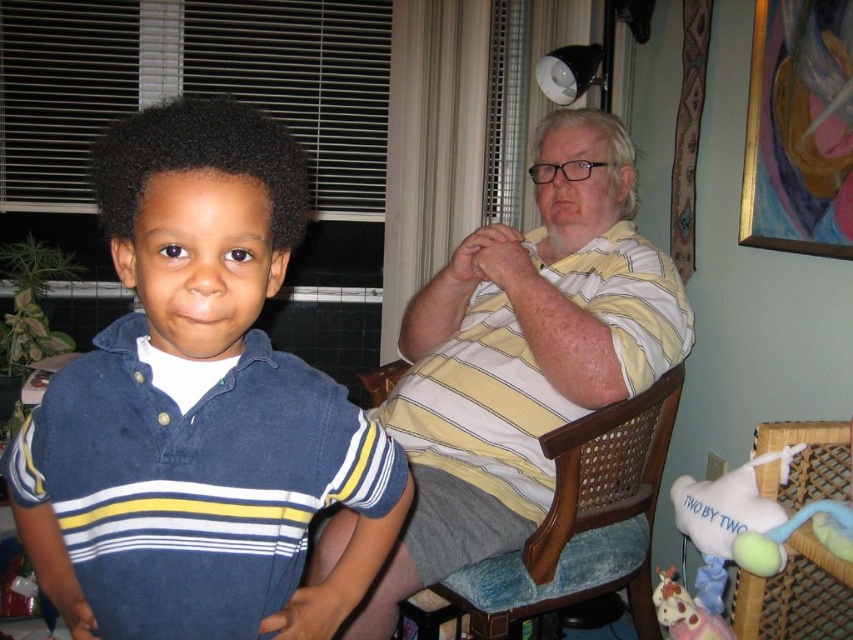
Question: Can you confirm if matte blue shirt at left is wider than woven wicker chair at lower right?

Choices:
 (A) yes
 (B) no

Answer: (A)

Question: Can you confirm if matte blue shirt at left is positioned below woven wicker chair at lower right?

Choices:
 (A) no
 (B) yes

Answer: (A)

Question: Which object is farther from the camera taking this photo?

Choices:
 (A) woven wicker chair at lower right
 (B) wooden at right

Answer: (B)

Question: Does wooden at right have a larger size compared to pastel plush unicorn at lower right?

Choices:
 (A) no
 (B) yes

Answer: (B)

Question: Among these points, which one is nearest to the camera?

Choices:
 (A) pyautogui.click(x=392, y=618)
 (B) pyautogui.click(x=225, y=548)
 (C) pyautogui.click(x=683, y=497)

Answer: (B)

Question: Among these objects, which one is farthest from the camera?

Choices:
 (A) matte blue shirt at left
 (B) wooden at right
 (C) yellow striped shirt at center

Answer: (B)